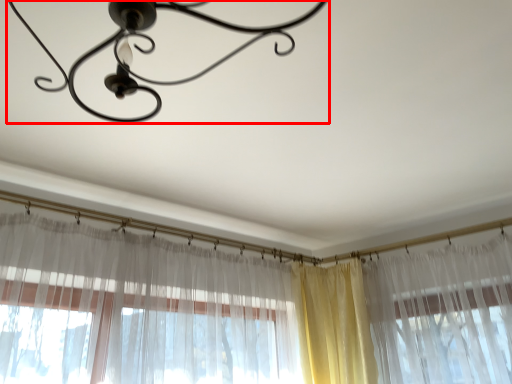
Question: Considering the relative positions of lamp (annotated by the red box) and curtain in the image provided, where is lamp (annotated by the red box) located with respect to the staircase?

Choices:
 (A) left
 (B) right

Answer: (A)